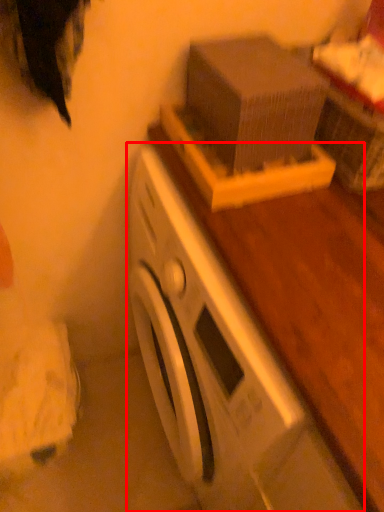
Question: From the image's perspective, where is washing machine (annotated by the red box) located relative to box?

Choices:
 (A) below
 (B) above

Answer: (A)